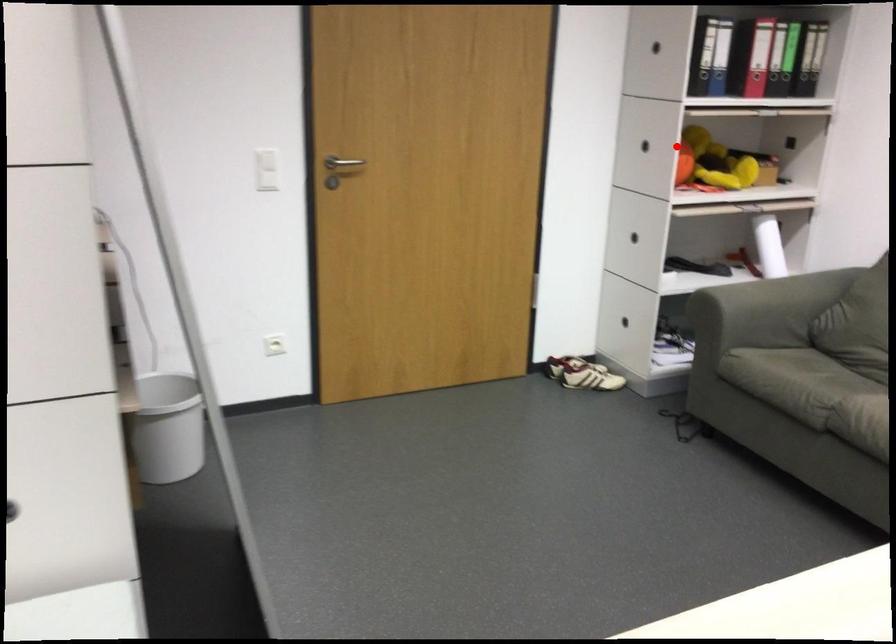
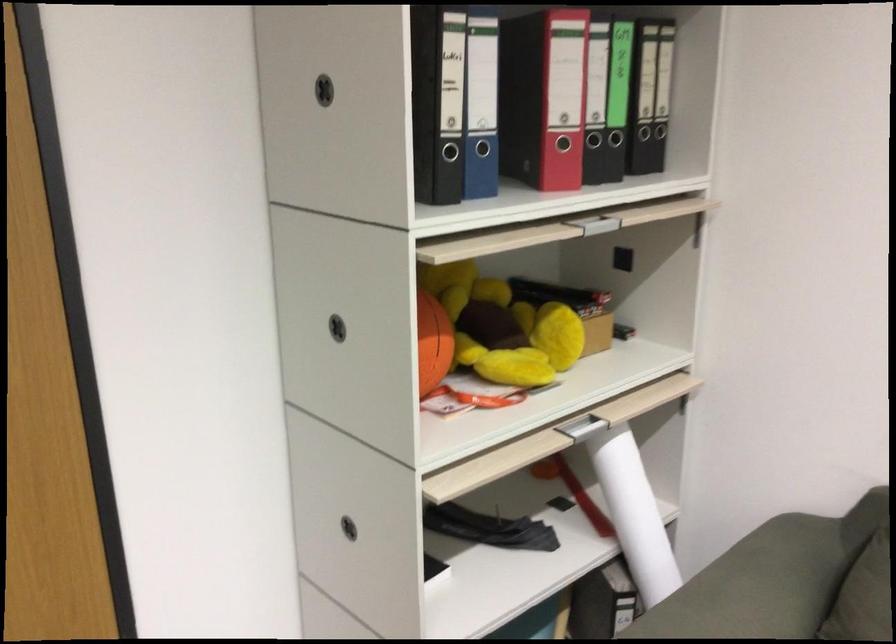
Question: I am providing you with two images of the same scene from different viewpoints. A red point is shown in image1. For the corresponding object point in image2, is it positioned nearer or farther from the camera?

Choices:
 (A) Nearer
 (B) Farther

Answer: (A)